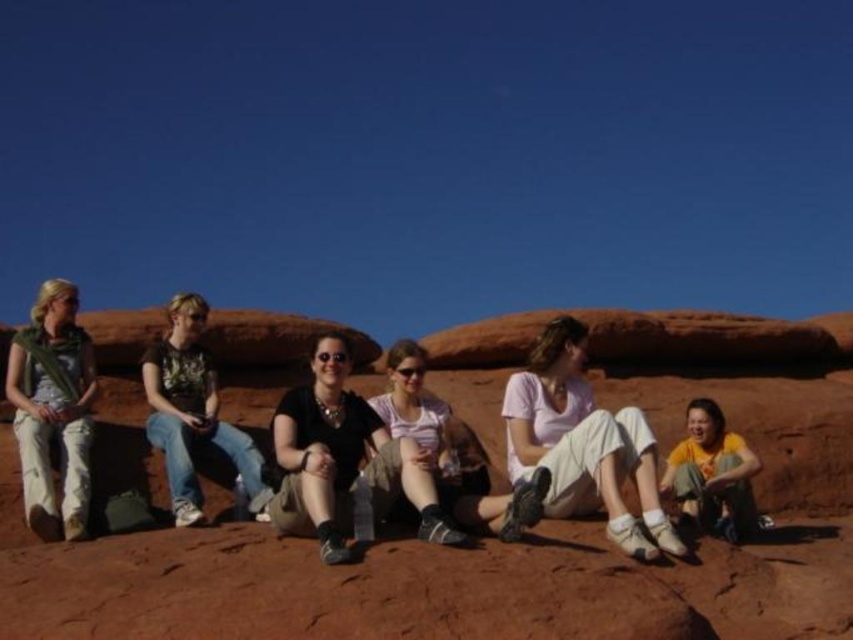
Question: Which of these objects is positioned farthest from the matte black shirt at center?

Choices:
 (A) matte pink shirt at center
 (B) white cotton pants at center
 (C) reddish-brown rock at center

Answer: (B)

Question: Can you confirm if reddish-brown rock at center is smaller than matte pink shirt at center?

Choices:
 (A) no
 (B) yes

Answer: (A)

Question: Which point appears farthest from the camera in this image?

Choices:
 (A) (74, 550)
 (B) (318, 396)

Answer: (B)

Question: Which point is closer to the camera?

Choices:
 (A) (486, 458)
 (B) (44, 404)

Answer: (B)

Question: Does green scarf at left appear on the left side of matte pink shirt at center?

Choices:
 (A) yes
 (B) no

Answer: (A)

Question: Does matte black shirt at center have a smaller size compared to matte pink shirt at center?

Choices:
 (A) no
 (B) yes

Answer: (B)